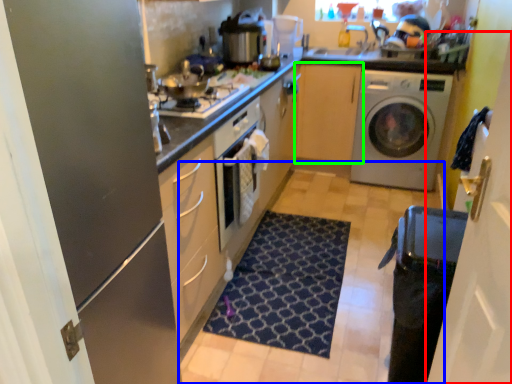
Question: Which object is positioned farthest from glass door (highlighted by a red box)? Select from plain (highlighted by a blue box) and cabinetry (highlighted by a green box).

Choices:
 (A) plain
 (B) cabinetry

Answer: (B)